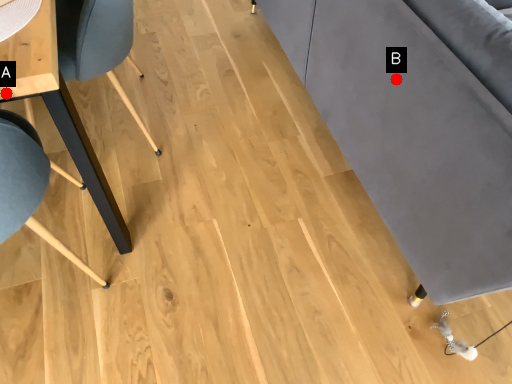
Question: Two points are circled on the image, labeled by A and B beside each circle. Which of the following is the farthest from the observer?

Choices:
 (A) A is further
 (B) B is further

Answer: (B)